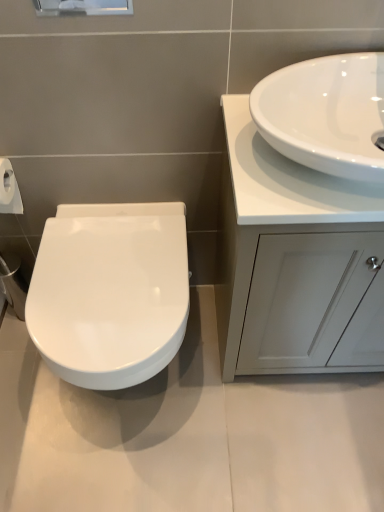
Describe the element at coordinates (110, 292) in the screenshot. I see `white glossy toilet at left` at that location.

At what (x,y) coordinates should I click in order to perform the action: click on white glossy cabinet at right. Please return your answer as a coordinate pair (x, y). Looking at the image, I should click on (298, 262).

The width and height of the screenshot is (384, 512). Find the location of `white glossy sink at upper right`. white glossy sink at upper right is located at coordinates (326, 114).

Describe the element at coordinates (326, 114) in the screenshot. This screenshot has width=384, height=512. I see `white glossy sink at upper right` at that location.

Where is `white glossy toilet at left`? The image size is (384, 512). white glossy toilet at left is located at coordinates (110, 292).

Between point (335, 121) and point (129, 378), which one is positioned behind?

The point (129, 378) is behind.

Based on the photo, which object is closer to the camera, white glossy sink at upper right or white glossy toilet at left?

white glossy sink at upper right is more forward.

Is white glossy sink at upper right to the left of white glossy toilet at left from the viewer's perspective?

No, white glossy sink at upper right is not to the left of white glossy toilet at left.

Between white glossy sink at upper right and white glossy toilet at left, which one has larger width?

white glossy toilet at left.

What's the angular difference between white glossy cabinet at right and white glossy sink at upper right's facing directions?

0.00106 degrees separate the facing orientations of white glossy cabinet at right and white glossy sink at upper right.

From a real-world perspective, who is located lower, white glossy cabinet at right or white glossy sink at upper right?

From a 3D spatial view, white glossy cabinet at right is below.

Is point (237, 194) closer or farther from the camera than point (330, 78)?

Clearly, point (237, 194) is closer to the camera than point (330, 78).

Is white glossy cabinet at right taller than white glossy sink at upper right?

Indeed, white glossy cabinet at right has a greater height compared to white glossy sink at upper right.

Which of these two, white glossy sink at upper right or white glossy cabinet at right, stands shorter?

Standing shorter between the two is white glossy sink at upper right.

From the image's perspective, is white glossy sink at upper right below white glossy cabinet at right?

Incorrect, from the image's perspective, white glossy sink at upper right is higher than white glossy cabinet at right.

Is white glossy cabinet at right located within white glossy sink at upper right?

No, white glossy cabinet at right is not inside white glossy sink at upper right.

Considering the sizes of objects white glossy cabinet at right and white glossy toilet at left in the image provided, who is shorter, white glossy cabinet at right or white glossy toilet at left?

With less height is white glossy toilet at left.

Does white glossy cabinet at right appear on the left side of white glossy toilet at left?

Incorrect, white glossy cabinet at right is not on the left side of white glossy toilet at left.

From a real-world perspective, which is physically above, white glossy cabinet at right or white glossy toilet at left?

white glossy cabinet at right.

From the image's perspective, does white glossy cabinet at right appear lower than white glossy toilet at left?

No, from the image's perspective, white glossy cabinet at right is not below white glossy toilet at left.

Is the position of white glossy toilet at left less distant than that of white glossy cabinet at right?

No.

Is white glossy toilet at left not close to white glossy cabinet at right?

No, white glossy toilet at left is not far from white glossy cabinet at right.

In order to click on toilet lying behind the white glossy cabinet at right in this screenshot , I will do `click(110, 292)`.

Between point (46, 321) and point (313, 270), which one is positioned in front?

The point (313, 270) is closer to the camera.

From a real-world perspective, is white glossy toilet at left on white glossy sink at upper right?

No, from a real-world perspective, white glossy toilet at left is not on top of white glossy sink at upper right.

Considering the points (95, 348) and (287, 93), which point is behind, point (95, 348) or point (287, 93)?

The point (95, 348) is more distant.

From the picture: Is white glossy toilet at left thinner than white glossy sink at upper right?

No.

Find the location of a particular element. The height and width of the screenshot is (512, 384). sink in front of the white glossy toilet at left is located at coordinates (326, 114).

Where is `sink above the white glossy cabinet at right (from a real-world perspective)`? Image resolution: width=384 pixels, height=512 pixels. sink above the white glossy cabinet at right (from a real-world perspective) is located at coordinates (326, 114).

Which object lies nearer to the anchor point white glossy toilet at left, white glossy cabinet at right or white glossy sink at upper right?

white glossy cabinet at right.

Estimate the real-world distances between objects in this image. Which object is further from white glossy sink at upper right, white glossy toilet at left or white glossy cabinet at right?

white glossy toilet at left.

Looking at the image, which one is located further to white glossy sink at upper right, white glossy cabinet at right or white glossy toilet at left?

Among the two, white glossy toilet at left is located further to white glossy sink at upper right.

Which object lies nearer to the anchor point white glossy cabinet at right, white glossy sink at upper right or white glossy toilet at left?

The object closer to white glossy cabinet at right is white glossy sink at upper right.

In the scene shown: Which object lies further to the anchor point white glossy toilet at left, white glossy sink at upper right or white glossy cabinet at right?

white glossy sink at upper right is further to white glossy toilet at left.

From the image, which object appears to be nearer to white glossy cabinet at right, white glossy toilet at left or white glossy sink at upper right?

white glossy sink at upper right is closer to white glossy cabinet at right.

In order to click on sink located between white glossy toilet at left and white glossy cabinet at right in the left-right direction in this screenshot , I will do `click(326, 114)`.